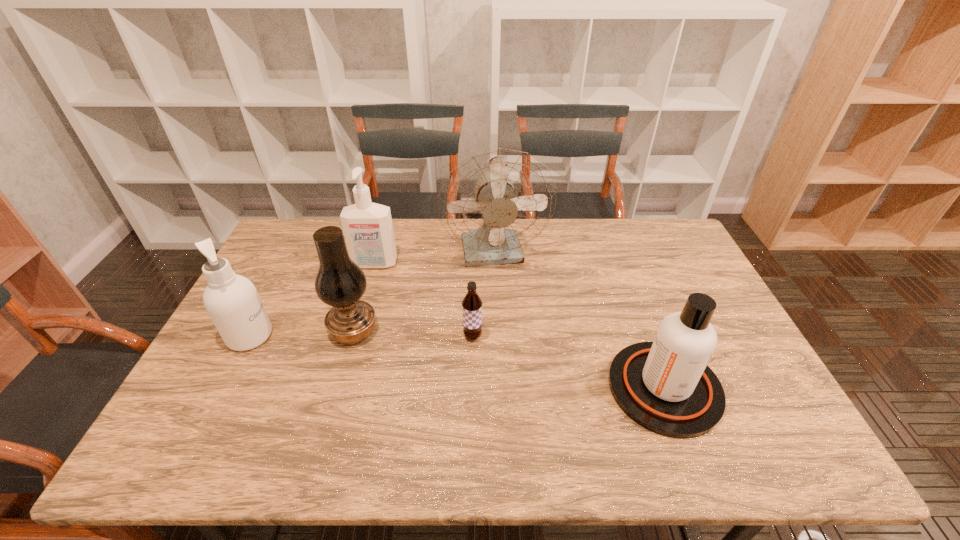
Where is `fan`? The width and height of the screenshot is (960, 540). fan is located at coordinates (494, 202).

I want to click on the second cleansing agent from right to left, so click(x=368, y=230).

Where is `oil lamp`? oil lamp is located at coordinates (340, 282).

Locate an element on the screen. The image size is (960, 540). the leftmost cleansing agent is located at coordinates (232, 301).

Locate an element on the screen. This screenshot has height=540, width=960. the rightmost object is located at coordinates (665, 386).

Find the location of a particular element. root beer is located at coordinates (471, 304).

In order to click on free space located 0.220m in front of the fan to blow air in this screenshot , I will do `click(498, 332)`.

This screenshot has height=540, width=960. What are the coordinates of `vacant space located 0.350m on the front label of the farthest cleansing agent` in the screenshot? It's located at (348, 357).

At what (x,y) coordinates should I click in order to perform the action: click on free space located on the right of the oil lamp. Please return your answer as a coordinate pair (x, y). This screenshot has height=540, width=960. Looking at the image, I should click on (464, 331).

The width and height of the screenshot is (960, 540). Identify the location of free space located 0.120m on the front label of the leftmost object. (315, 336).